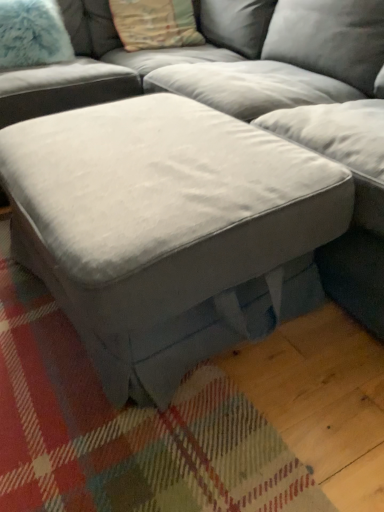
Question: In the image, is fuzzy white pillow at upper left, the 2th pillow viewed from the right, positioned in front of or behind suede gray ottoman at center?

Choices:
 (A) front
 (B) behind

Answer: (B)

Question: From a real-world perspective, is fuzzy white pillow at upper left, which is the 1th pillow in left-to-right order, physically located above or below suede gray ottoman at center?

Choices:
 (A) above
 (B) below

Answer: (A)

Question: Based on their relative distances, which object is farther from the textured beige pillow at upper center, the second pillow positioned from the left?

Choices:
 (A) fuzzy white pillow at upper left, the 2th pillow viewed from the right
 (B) suede gray ottoman at center

Answer: (B)

Question: Which object is positioned farthest from the fuzzy white pillow at upper left, which is the 1th pillow in left-to-right order?

Choices:
 (A) suede gray ottoman at center
 (B) textured beige pillow at upper center, arranged as the 1th pillow when viewed from the right

Answer: (A)